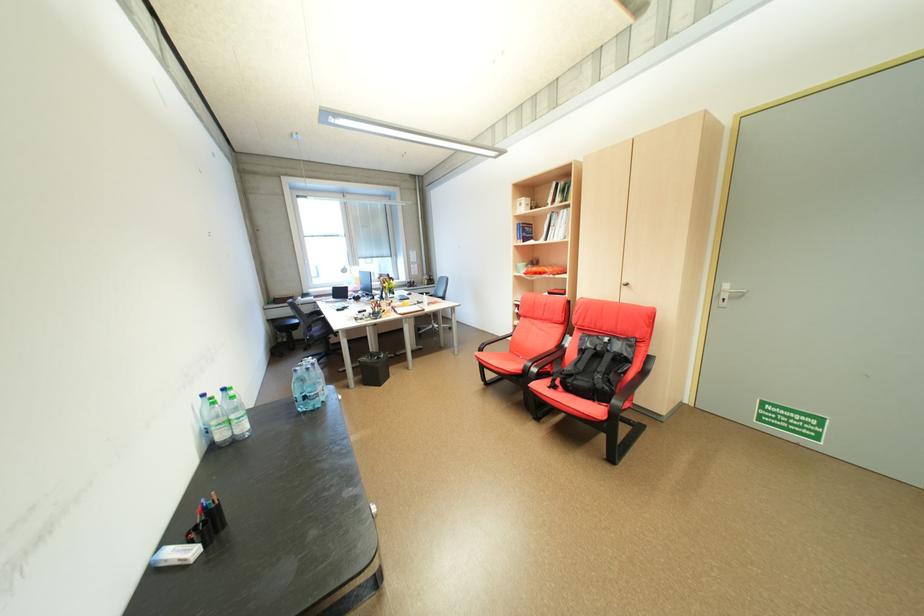
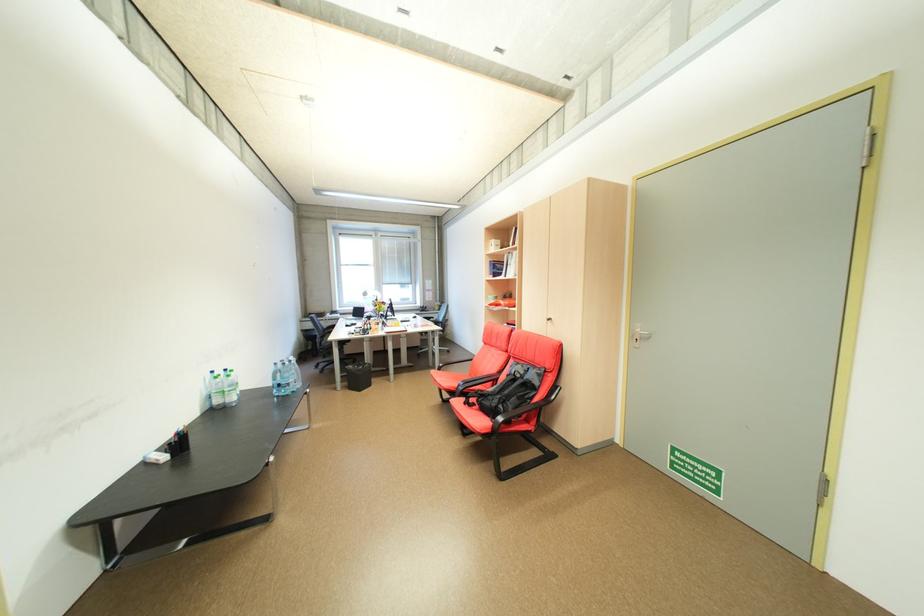
Question: Which direction would the cameraman need to move to produce the second image? Reply with the corresponding letter.

Choices:
 (A) Left
 (B) Right
 (C) Forward
 (D) Backward

Answer: (B)